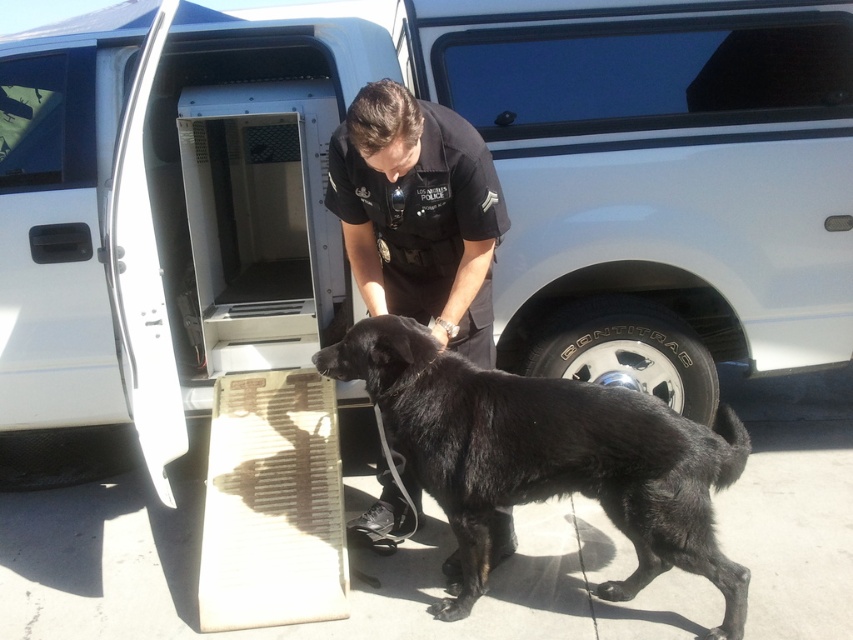
Question: Can you confirm if black fur dog at center is positioned to the left of black uniformed officer at center?

Choices:
 (A) no
 (B) yes

Answer: (A)

Question: Can you confirm if black fur dog at center is positioned to the left of black uniformed officer at center?

Choices:
 (A) no
 (B) yes

Answer: (A)

Question: Is black fur dog at center to the left of black uniformed officer at center from the viewer's perspective?

Choices:
 (A) yes
 (B) no

Answer: (B)

Question: Among these objects, which one is nearest to the camera?

Choices:
 (A) black fur dog at center
 (B) black uniformed officer at center

Answer: (B)